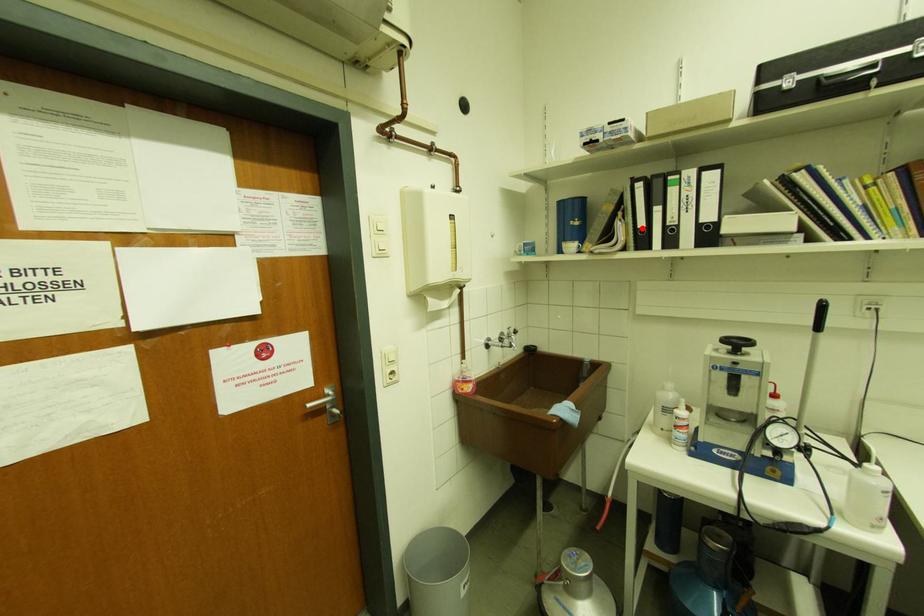
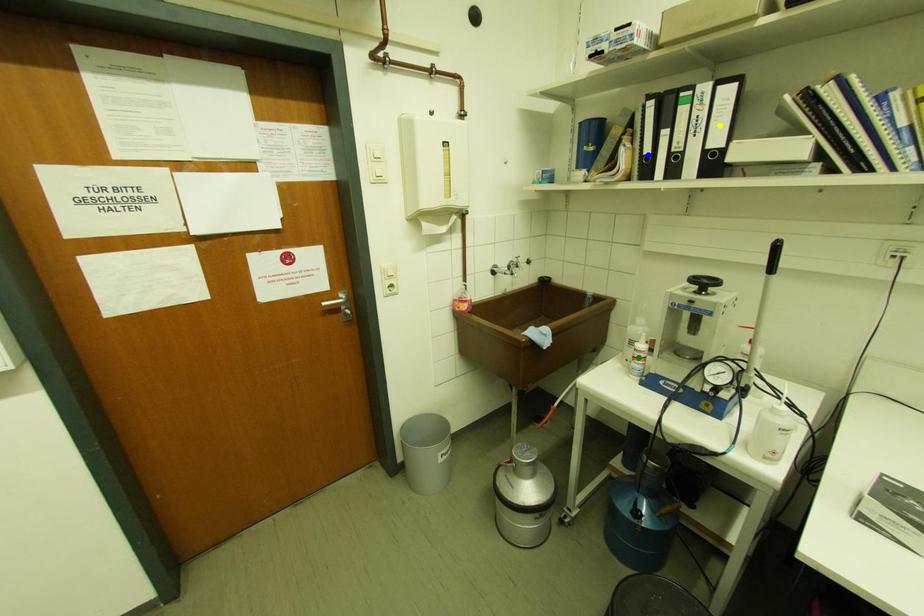
Question: I am providing you with two images of the same scene from different viewpoints. A red point is marked on the first image. You are given multiple points on the second image. Which mark in image 2 goes with the point in image 1?

Choices:
 (A) blue point
 (B) yellow point
 (C) green point

Answer: (A)